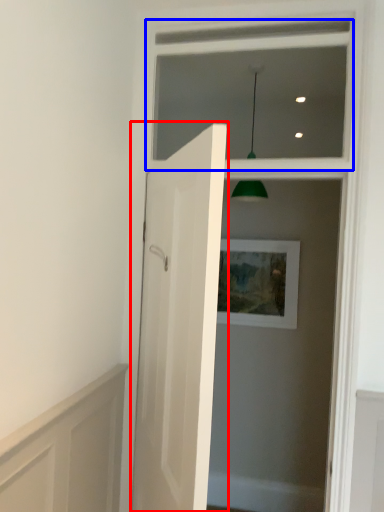
Question: Among these objects, which one is nearest to the camera, door (highlighted by a red box) or window frame (highlighted by a blue box)?

Choices:
 (A) door
 (B) window frame

Answer: (A)